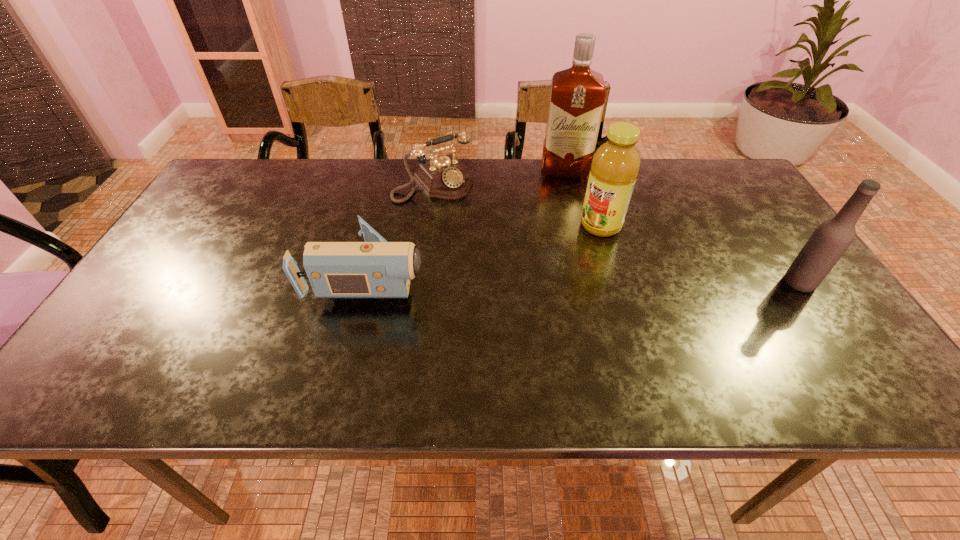
Identify the location of free space located 0.400m on the dial of the telephone. (x=533, y=289).

Where is `vacant space situated 0.070m on the dial of the telephone`? Image resolution: width=960 pixels, height=540 pixels. vacant space situated 0.070m on the dial of the telephone is located at coordinates (465, 214).

Identify the location of vacant space located 0.190m on the front label of the tallest object. Image resolution: width=960 pixels, height=540 pixels. (566, 220).

You are a GUI agent. You are given a task and a screenshot of the screen. Output one action in this format:
    pyautogui.click(x=<x>, y=<y>)
    Task: Click on the vacant region located 0.070m on the front label of the tallest object
    The image size is (960, 540).
    Given the screenshot: What is the action you would take?
    pyautogui.click(x=565, y=194)

Identify the location of blank space located 0.130m on the front label of the tallest object. The height and width of the screenshot is (540, 960). (566, 207).

Identify the location of telephone located at the far edge. The height and width of the screenshot is (540, 960). (446, 177).

Locate an element on the screen. This screenshot has height=540, width=960. liquor that is at the far edge is located at coordinates (577, 96).

I want to click on object that is at the right edge, so tap(830, 240).

Find the location of `vacant space at the far edge of the desktop`. vacant space at the far edge of the desktop is located at coordinates (339, 170).

I want to click on vacant region at the near edge, so click(x=480, y=339).